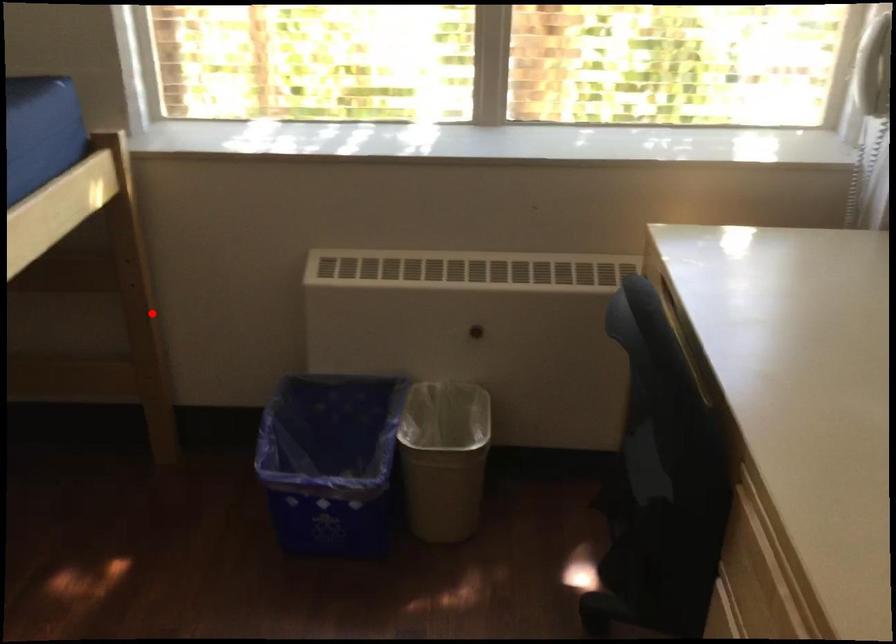
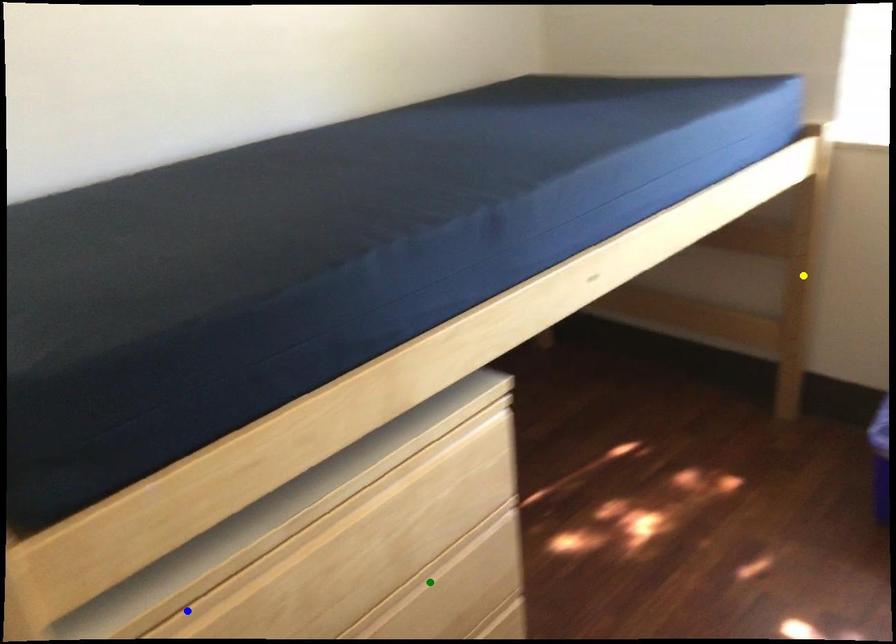
Question: I am providing you with two images of the same scene from different viewpoints. A red point is marked on the first image. You are given multiple points on the second image. Which mark in image 2 goes with the point in image 1?

Choices:
 (A) blue point
 (B) yellow point
 (C) green point

Answer: (B)